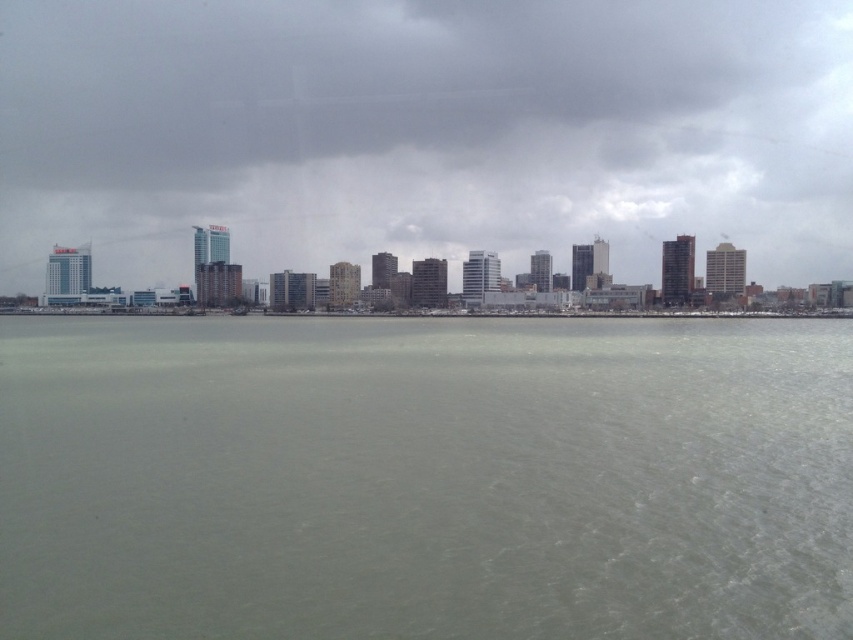
How much distance is there between gray matte water at center and gray cloudy sky at upper center?

gray matte water at center and gray cloudy sky at upper center are 140.82 meters apart from each other.

Between gray matte water at center and gray cloudy sky at upper center, which one has more height?

Standing taller between the two is gray cloudy sky at upper center.

You are a GUI agent. You are given a task and a screenshot of the screen. Output one action in this format:
    pyautogui.click(x=<x>, y=<y>)
    Task: Click on the gray matte water at center
    
    Given the screenshot: What is the action you would take?
    pyautogui.click(x=425, y=480)

At what (x,y) coordinates should I click in order to perform the action: click on gray matte water at center. Please return your answer as a coordinate pair (x, y). This screenshot has width=853, height=640. Looking at the image, I should click on click(425, 480).